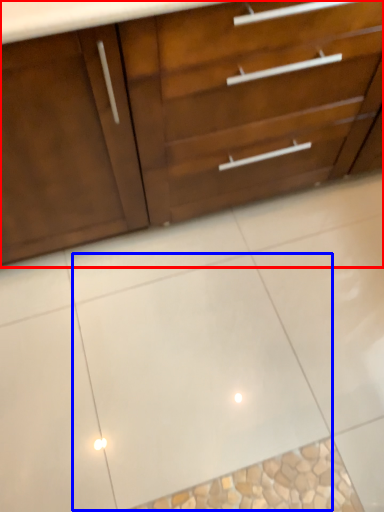
Question: Which object is further to the camera taking this photo, chest of drawers (highlighted by a red box) or ceramic tile (highlighted by a blue box)?

Choices:
 (A) chest of drawers
 (B) ceramic tile

Answer: (B)